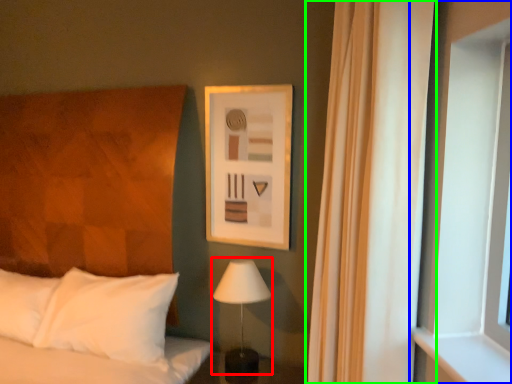
Question: Based on their relative distances, which object is nearer to table lamp (highlighted by a red box)? Choose from window (highlighted by a blue box) and curtain (highlighted by a green box).

Choices:
 (A) window
 (B) curtain

Answer: (B)